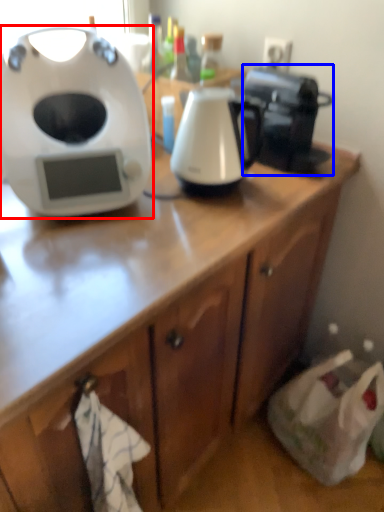
Question: Which point is further to the camera, home appliance (highlighted by a red box) or coffee maker (highlighted by a blue box)?

Choices:
 (A) home appliance
 (B) coffee maker

Answer: (B)